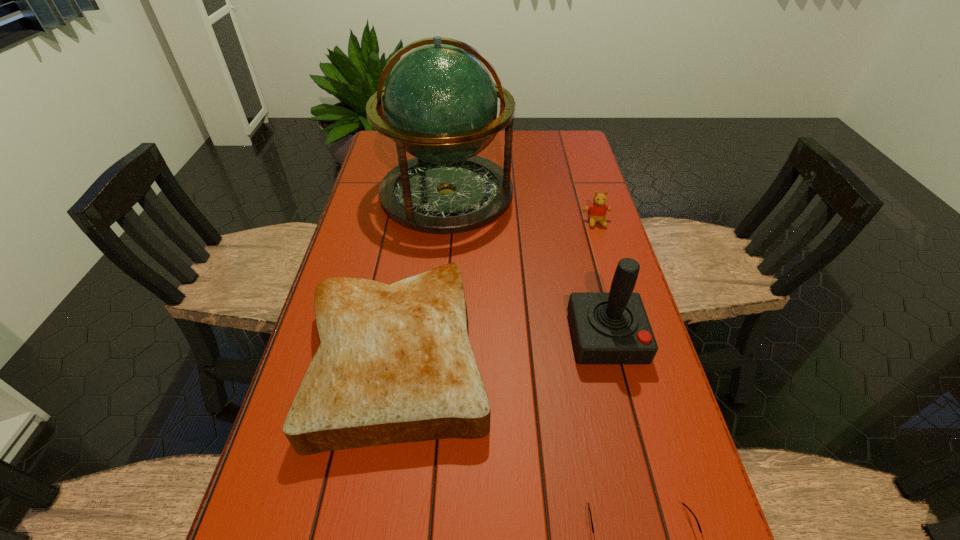
The height and width of the screenshot is (540, 960). Identify the location of vacant region between the tallest object and the second tallest object. (526, 266).

Locate an element on the screen. This screenshot has width=960, height=540. empty location between the teddy bear and the second tallest object is located at coordinates (601, 280).

At what (x,y) coordinates should I click in order to perform the action: click on object that is the fourth closest to the globe. Please return your answer as a coordinate pair (x, y). This screenshot has width=960, height=540. Looking at the image, I should click on (698, 524).

Where is `object that can be found as the fourth closest to the bread`? object that can be found as the fourth closest to the bread is located at coordinates (596, 211).